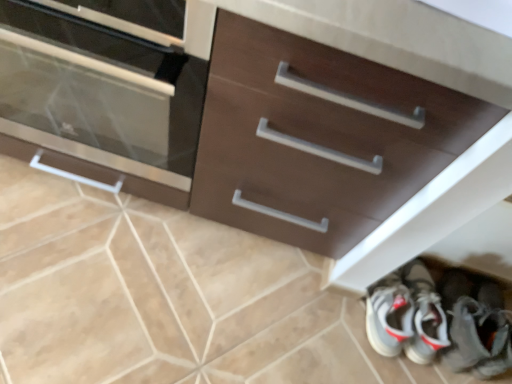
Question: Does beige ceramic tile at lower center have a greater width compared to matte brown cabinet at left?

Choices:
 (A) no
 (B) yes

Answer: (A)

Question: Could you tell me if beige ceramic tile at lower center is facing matte brown cabinet at left?

Choices:
 (A) yes
 (B) no

Answer: (B)

Question: Is beige ceramic tile at lower center closer to camera compared to matte brown cabinet at left?

Choices:
 (A) yes
 (B) no

Answer: (B)

Question: Considering the relative sizes of beige ceramic tile at lower center and matte brown cabinet at left in the image provided, is beige ceramic tile at lower center shorter than matte brown cabinet at left?

Choices:
 (A) yes
 (B) no

Answer: (A)

Question: Is beige ceramic tile at lower center not near matte brown cabinet at left?

Choices:
 (A) yes
 (B) no

Answer: (B)

Question: Is beige ceramic tile at lower center positioned behind matte brown cabinet at left?

Choices:
 (A) no
 (B) yes

Answer: (B)

Question: Is white leather sneakers at lower right bigger than matte brown cabinet at left?

Choices:
 (A) no
 (B) yes

Answer: (A)

Question: Considering the relative sizes of white leather sneakers at lower right and matte brown cabinet at left in the image provided, is white leather sneakers at lower right wider than matte brown cabinet at left?

Choices:
 (A) yes
 (B) no

Answer: (B)

Question: From a real-world perspective, is white leather sneakers at lower right physically below matte brown cabinet at left?

Choices:
 (A) yes
 (B) no

Answer: (A)

Question: Does white leather sneakers at lower right turn towards matte brown cabinet at left?

Choices:
 (A) no
 (B) yes

Answer: (A)

Question: Does white leather sneakers at lower right have a greater height compared to matte brown cabinet at left?

Choices:
 (A) no
 (B) yes

Answer: (A)

Question: Is white leather sneakers at lower right turned away from matte brown cabinet at left?

Choices:
 (A) no
 (B) yes

Answer: (A)

Question: Is matte brown cabinet at left placed right next to white leather sneakers at lower right?

Choices:
 (A) no
 (B) yes

Answer: (A)